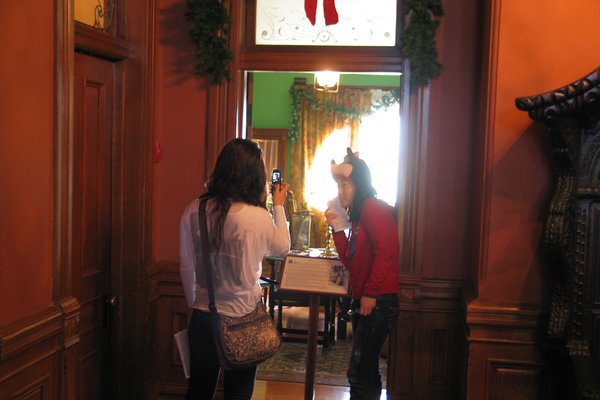
This screenshot has width=600, height=400. I want to click on floor, so click(285, 391).